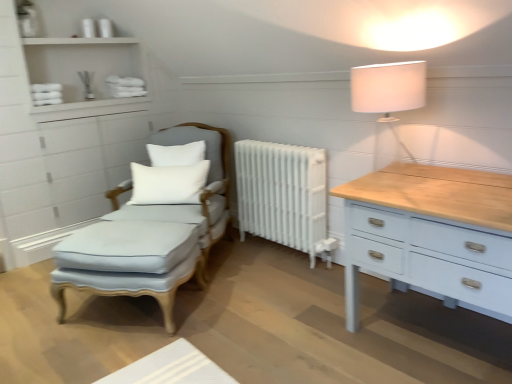
At what (x,y) coordinates should I click in order to perform the action: click on free space in front of white painted radiator at center. Please return your answer as a coordinate pair (x, y). Image resolution: width=512 pixels, height=384 pixels. Looking at the image, I should click on (287, 284).